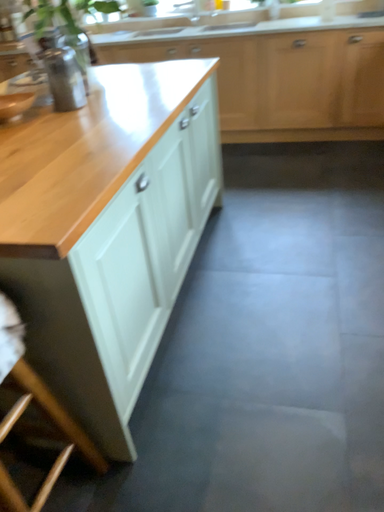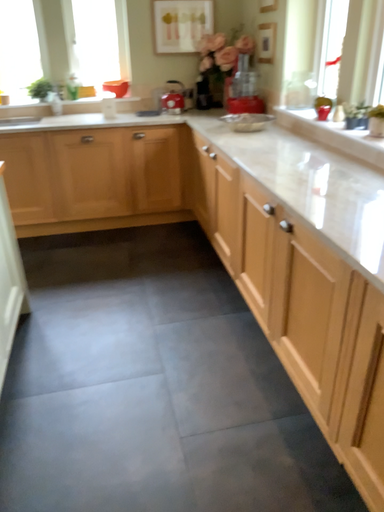
Question: Which way did the camera rotate in the video?

Choices:
 (A) rotated downward
 (B) rotated upward

Answer: (B)